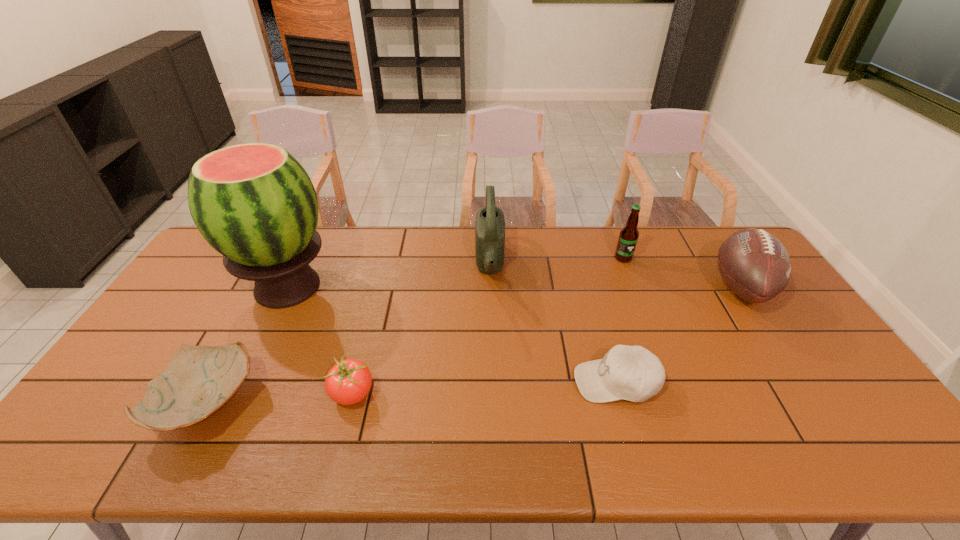
Where is `free space that is in between the sixth object from left to right and the third object from left to right`? This screenshot has height=540, width=960. free space that is in between the sixth object from left to right and the third object from left to right is located at coordinates (488, 327).

The height and width of the screenshot is (540, 960). What are the coordinates of `vacant space in between the tomato and the football (American)` in the screenshot? It's located at (547, 341).

The image size is (960, 540). Identify the location of vacant area between the pottery and the beer bottle. (416, 332).

Where is `vacant area that lies between the beer bottle and the tallest object`? The height and width of the screenshot is (540, 960). vacant area that lies between the beer bottle and the tallest object is located at coordinates (455, 273).

Where is `vacant area between the tomato and the pottery`? vacant area between the tomato and the pottery is located at coordinates (280, 400).

Identify the location of unoccupied area between the football (American) and the watering can. (615, 276).

You are a GUI agent. You are given a task and a screenshot of the screen. Output one action in this format:
    pyautogui.click(x=<x>, y=<y>)
    Task: Click on the vacant space that's between the watering can and the beer bottle
    
    Given the screenshot: What is the action you would take?
    pyautogui.click(x=557, y=261)

In order to click on unoccupied area between the pottery and the tallest object in this screenshot , I will do `click(248, 346)`.

Where is `the third closest object to the watermelon`? the third closest object to the watermelon is located at coordinates (490, 224).

Select which object is the third closest to the pottery. Please provide its 2D coordinates. Your answer should be formatted as a tuple, i.e. [(x, y)], where the tuple contains the x and y coordinates of a point satisfying the conditions above.

[(490, 224)]